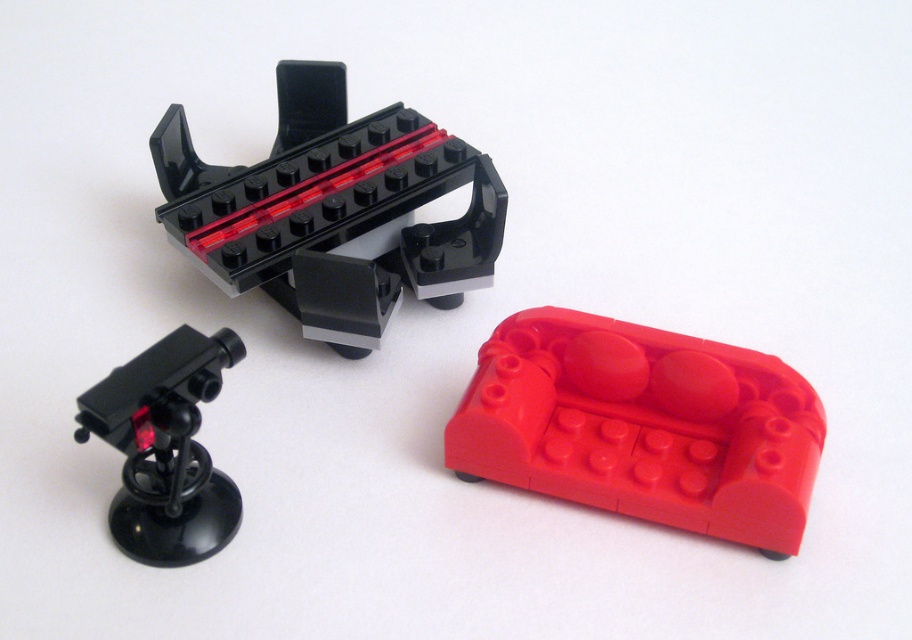
Question: Which of the following is the closest to the observer?

Choices:
 (A) (292, 138)
 (B) (477, 368)

Answer: (B)

Question: Does black plastic/brick at upper center appear over matte black telescope at upper left?

Choices:
 (A) yes
 (B) no

Answer: (A)

Question: Which of these objects is positioned closest to the black plastic/brick at upper center?

Choices:
 (A) rubber red couch at center
 (B) matte black telescope at upper left

Answer: (B)

Question: Which of the following is the closest to the observer?

Choices:
 (A) rubber red couch at center
 (B) black plastic/brick at upper center

Answer: (A)

Question: Is black plastic/brick at upper center positioned at the back of matte black telescope at upper left?

Choices:
 (A) no
 (B) yes

Answer: (B)

Question: Does black plastic/brick at upper center lie in front of matte black telescope at upper left?

Choices:
 (A) yes
 (B) no

Answer: (B)